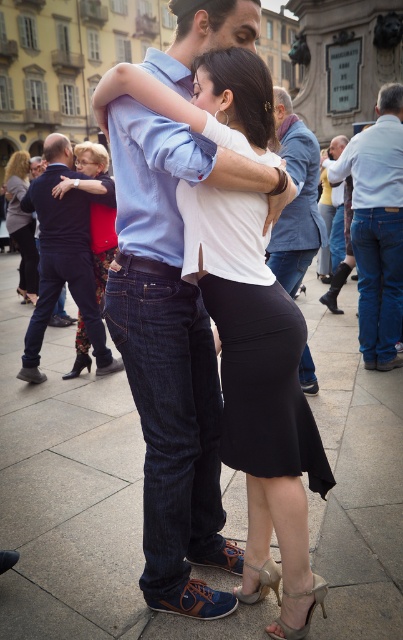
Is point (53, 230) in front of point (292, 221)?

No.

Looking at this image, which of these two, dark blue suit at center or denim jeans at center, stands taller?

With more height is denim jeans at center.

Is point (89, 237) closer to camera compared to point (274, 120)?

No, it is behind (274, 120).

Locate an element on the screen. The width and height of the screenshot is (403, 640). dark blue suit at center is located at coordinates (64, 256).

Is point (58, 205) positioned in front of point (22, 192)?

Yes, point (58, 205) is closer to viewer.

Is dark blue suit at center to the right of matte black dress at lower left from the viewer's perspective?

Indeed, dark blue suit at center is positioned on the right side of matte black dress at lower left.

Measure the distance between point (95, 333) and camera.

Point (95, 333) and camera are 22.45 feet apart from each other.

Where is `dark blue suit at center`? The width and height of the screenshot is (403, 640). dark blue suit at center is located at coordinates (64, 256).

Does matte blue jeans at center appear over dark blue suit at center?

No.

Which is behind, point (251, 477) or point (54, 157)?

Point (54, 157)

Where is `matte blue jeans at center`? The image size is (403, 640). matte blue jeans at center is located at coordinates (261, 392).

This screenshot has height=640, width=403. I want to click on matte blue jeans at center, so click(261, 392).